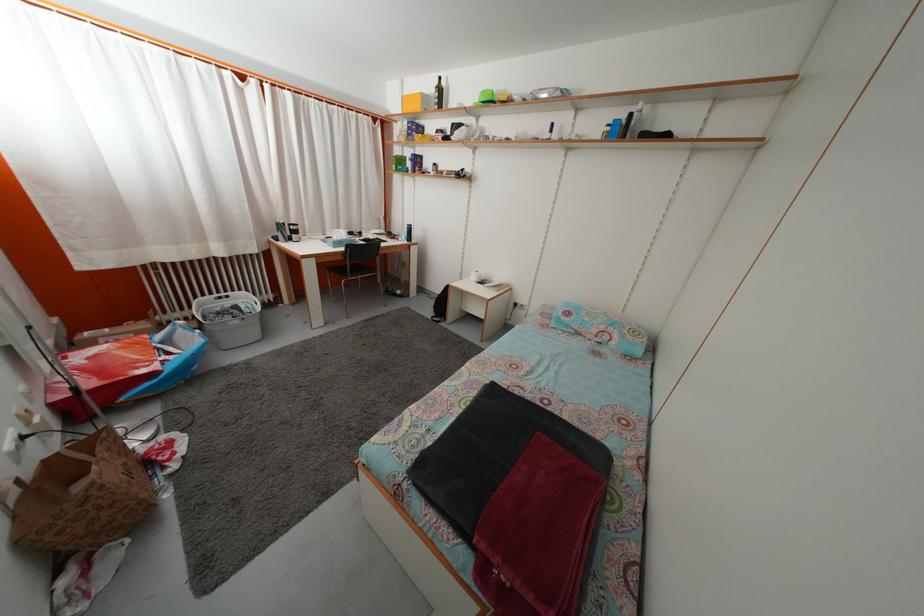
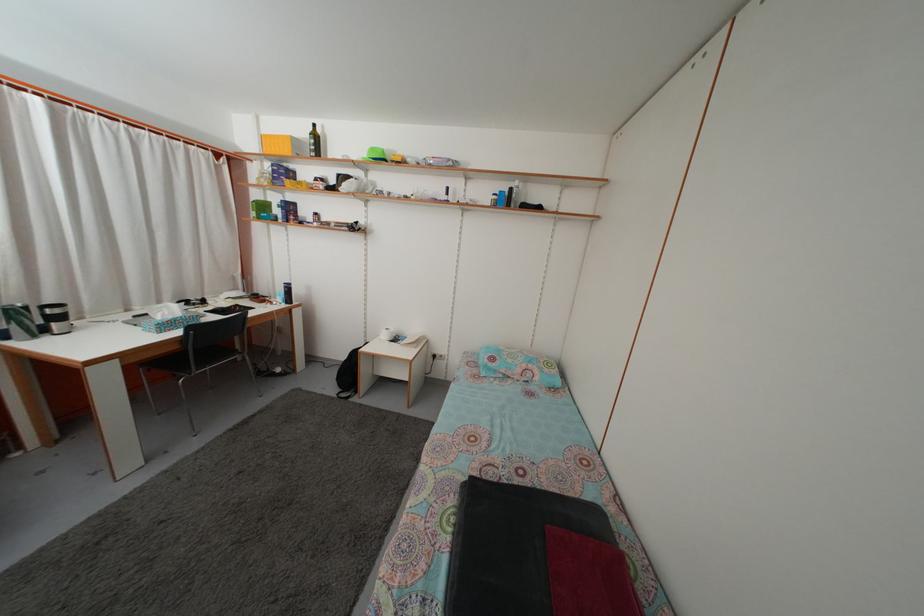
Question: How did the camera likely rotate?

Choices:
 (A) Left
 (B) Right
 (C) Up
 (D) Down

Answer: (B)